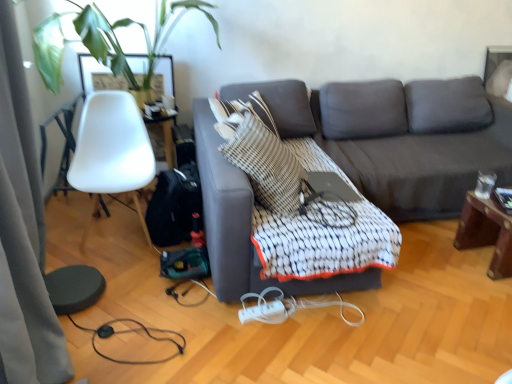
Locate an element on the screen. vacant space underneath black rubber cable at lower left, the 2th cable positioned from the right (from a real-world perspective) is located at coordinates (133, 350).